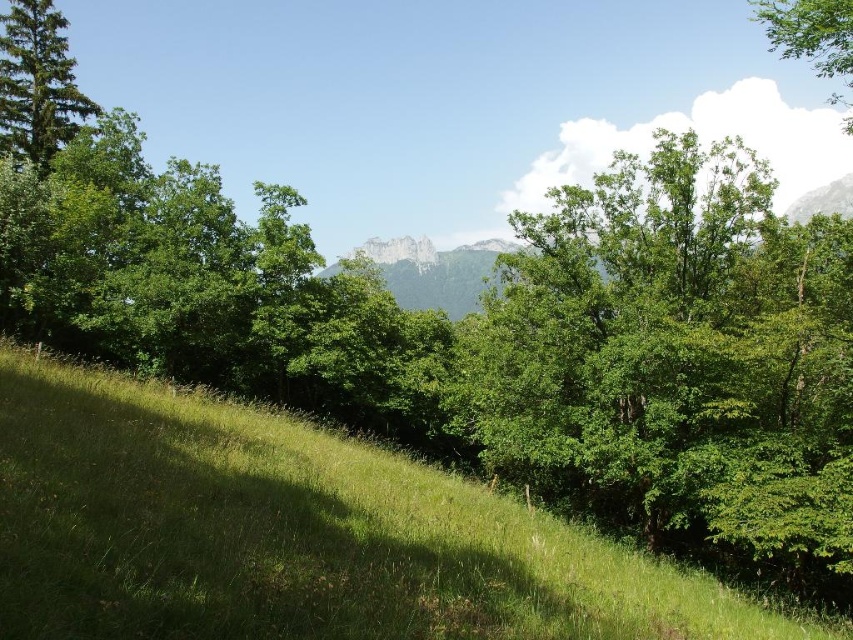
You are standing at the base of the green grassy hillside at lower left and want to reach the green leafy tree at upper right. Which direction should you move to get closer to the tree?

You should move upward from the green grassy hillside at lower left towards the green leafy tree at upper right since the tree is located above the hillside.

You are standing in the middle of the scene and want to walk towards the green grassy hillside at lower left and the green matte tree at upper left. Which direction should you walk to reach the wider area first?

The green grassy hillside at lower left is wider than the green matte tree at upper left. Since you are in the middle of the scene, walking towards the lower left direction will lead you to the wider green grassy hillside at lower left first.